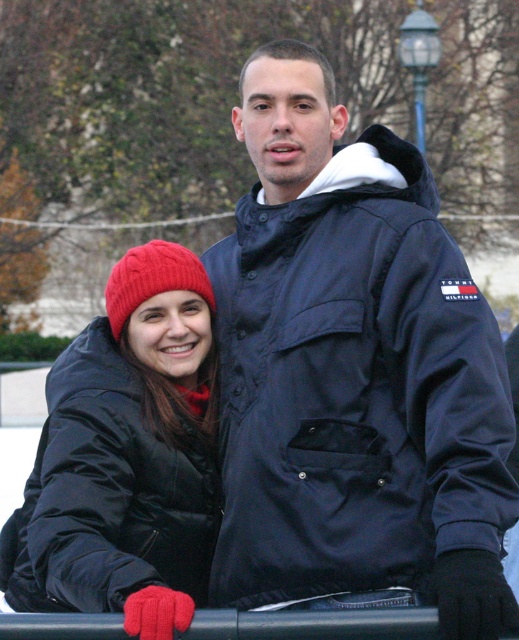
Question: Does matte black coat at lower left have a smaller size compared to cable-knit woolen beanie at left?

Choices:
 (A) no
 (B) yes

Answer: (A)

Question: Based on their relative distances, which object is nearer to the cable-knit woolen beanie at left?

Choices:
 (A) matte black coat at lower left
 (B) navy blue jacket at center

Answer: (A)

Question: Is navy blue jacket at center bigger than matte black coat at lower left?

Choices:
 (A) yes
 (B) no

Answer: (A)

Question: Which is farther from the cable-knit woolen beanie at left?

Choices:
 (A) matte black coat at lower left
 (B) navy blue jacket at center

Answer: (B)

Question: Does matte black coat at lower left appear under cable-knit woolen beanie at left?

Choices:
 (A) no
 (B) yes

Answer: (B)

Question: Which point is closer to the camera taking this photo?

Choices:
 (A) (207, 396)
 (B) (280, 540)
 (C) (184, 250)

Answer: (B)